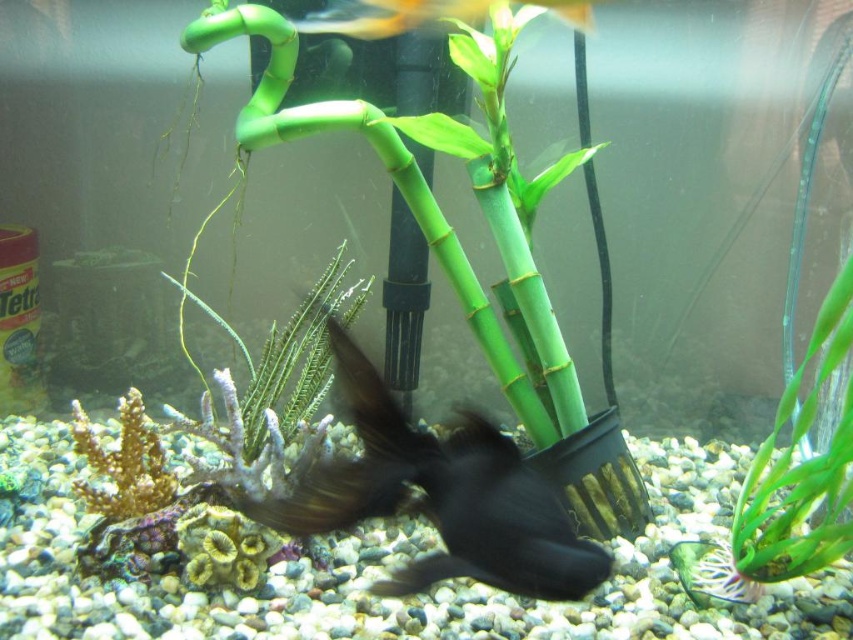
Which is below, black matte fish at center or green matte plant at right?

black matte fish at center

In the scene shown: Does black matte fish at center appear under green matte plant at right?

Correct, black matte fish at center is located below green matte plant at right.

What do you see at coordinates (457, 496) in the screenshot?
I see `black matte fish at center` at bounding box center [457, 496].

The height and width of the screenshot is (640, 853). What are the coordinates of `black matte fish at center` in the screenshot? It's located at (457, 496).

Who is taller, black matte fish at center or translucent yellow fish at upper center?

black matte fish at center

Does black matte fish at center appear on the right side of translucent yellow fish at upper center?

Yes, black matte fish at center is to the right of translucent yellow fish at upper center.

Who is more distant from viewer, (486, 532) or (367, 17)?

Point (367, 17)

Locate an element on the screen. The image size is (853, 640). black matte fish at center is located at coordinates (457, 496).

Who is more distant from viewer, (316, 369) or (397, 20)?

Positioned behind is point (397, 20).

Where is `green matte plant at center`? green matte plant at center is located at coordinates (294, 355).

Consider the image. Who is more forward, [296,372] or [564,1]?

Point [564,1]

The image size is (853, 640). Find the location of `green matte plant at center`. green matte plant at center is located at coordinates (294, 355).